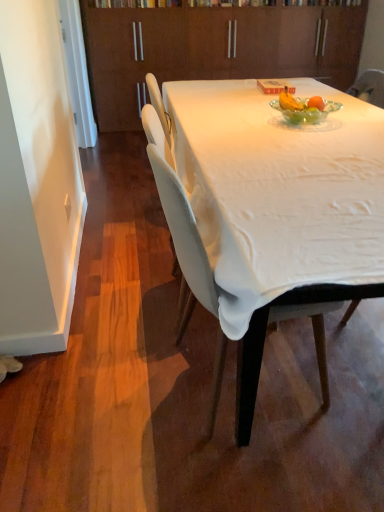
Where is `free space in front of white fabric chair at center`? The image size is (384, 512). free space in front of white fabric chair at center is located at coordinates (251, 467).